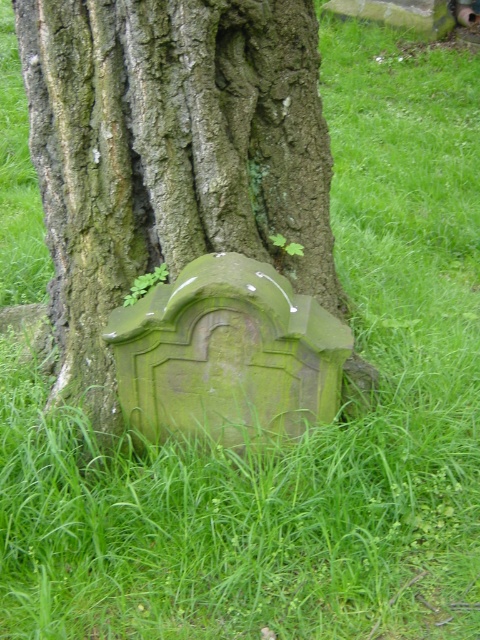
Who is positioned more to the right, green mossy stone at lower center or green stone gravestone at lower center?

Positioned to the right is green stone gravestone at lower center.

Locate an element on the screen. green mossy stone at lower center is located at coordinates (169, 154).

You are a GUI agent. You are given a task and a screenshot of the screen. Output one action in this format:
    pyautogui.click(x=<x>, y=<y>)
    Task: Click on the green mossy stone at lower center
    This screenshot has width=480, height=640.
    Given the screenshot: What is the action you would take?
    pyautogui.click(x=169, y=154)

Find the location of a particular element. green mossy stone at lower center is located at coordinates (169, 154).